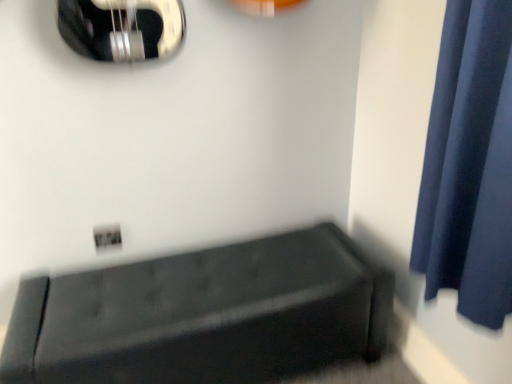
Measure the distance between point (448, 245) and camera.

A distance of 97.10 centimeters exists between point (448, 245) and camera.

Identify the location of dark blue fabric curtain at right. The height and width of the screenshot is (384, 512). (469, 165).

What do you see at coordinates (469, 165) in the screenshot? This screenshot has width=512, height=384. I see `dark blue fabric curtain at right` at bounding box center [469, 165].

Find the location of a particular element. This screenshot has height=384, width=512. velvet black bench at lower right is located at coordinates (205, 316).

This screenshot has width=512, height=384. What do you see at coordinates (205, 316) in the screenshot? I see `velvet black bench at lower right` at bounding box center [205, 316].

At what (x,y) coordinates should I click in order to perform the action: click on dark blue fabric curtain at right. Please return your answer as a coordinate pair (x, y). Looking at the image, I should click on point(469,165).

Which is more to the left, velvet black bench at lower right or dark blue fabric curtain at right?

velvet black bench at lower right.

Does velvet black bench at lower right come behind dark blue fabric curtain at right?

Yes.

Does point (323, 344) lie in front of point (456, 263)?

No, (323, 344) is behind (456, 263).

From the image's perspective, is velvet black bench at lower right on dark blue fabric curtain at right?

No, from the image's perspective, velvet black bench at lower right is not on top of dark blue fabric curtain at right.

From a real-world perspective, is velvet black bench at lower right located beneath dark blue fabric curtain at right?

Yes.

Considering the relative sizes of velvet black bench at lower right and dark blue fabric curtain at right in the image provided, is velvet black bench at lower right thinner than dark blue fabric curtain at right?

In fact, velvet black bench at lower right might be wider than dark blue fabric curtain at right.

Who is shorter, velvet black bench at lower right or dark blue fabric curtain at right?

velvet black bench at lower right is shorter.

Considering the sizes of objects velvet black bench at lower right and dark blue fabric curtain at right in the image provided, who is smaller, velvet black bench at lower right or dark blue fabric curtain at right?

dark blue fabric curtain at right is smaller.

Does velvet black bench at lower right contain dark blue fabric curtain at right?

Definitely not — dark blue fabric curtain at right is not inside velvet black bench at lower right.

Is velvet black bench at lower right directly adjacent to dark blue fabric curtain at right?

There is a gap between velvet black bench at lower right and dark blue fabric curtain at right.

Is velvet black bench at lower right turned away from dark blue fabric curtain at right?

No, dark blue fabric curtain at right is not at the back of velvet black bench at lower right.

The height and width of the screenshot is (384, 512). I want to click on curtain located above the velvet black bench at lower right (from a real-world perspective), so click(469, 165).

Which is more to the left, dark blue fabric curtain at right or velvet black bench at lower right?

velvet black bench at lower right.

Is dark blue fabric curtain at right in front of velvet black bench at lower right?

Yes, it is in front of velvet black bench at lower right.

Considering the points (490, 230) and (380, 313), which point is behind, point (490, 230) or point (380, 313)?

The point (380, 313) is farther.

From the image's perspective, which one is positioned higher, dark blue fabric curtain at right or velvet black bench at lower right?

dark blue fabric curtain at right appears higher in the image.

From a real-world perspective, which is physically above, dark blue fabric curtain at right or velvet black bench at lower right?

From a 3D spatial view, dark blue fabric curtain at right is above.

Is dark blue fabric curtain at right wider than velvet black bench at lower right?

Incorrect, the width of dark blue fabric curtain at right does not surpass that of velvet black bench at lower right.

Considering the sizes of dark blue fabric curtain at right and velvet black bench at lower right in the image, is dark blue fabric curtain at right taller or shorter than velvet black bench at lower right?

Considering their sizes, dark blue fabric curtain at right has more height than velvet black bench at lower right.

Does dark blue fabric curtain at right have a smaller size compared to velvet black bench at lower right?

Indeed, dark blue fabric curtain at right has a smaller size compared to velvet black bench at lower right.

Looking at this image, choose the correct answer: Is dark blue fabric curtain at right inside velvet black bench at lower right or outside it?

dark blue fabric curtain at right lies outside velvet black bench at lower right.

Is dark blue fabric curtain at right far from velvet black bench at lower right?

No.

In the scene shown: Does dark blue fabric curtain at right turn towards velvet black bench at lower right?

No, dark blue fabric curtain at right is not aimed at velvet black bench at lower right.

Where is `furniture to the left of dark blue fabric curtain at right`? The height and width of the screenshot is (384, 512). furniture to the left of dark blue fabric curtain at right is located at coordinates (205, 316).

This screenshot has width=512, height=384. In the image, there is a dark blue fabric curtain at right. Find the location of `furniture below it (from the image's perspective)`. furniture below it (from the image's perspective) is located at coordinates (205, 316).

At what (x,y) coordinates should I click in order to perform the action: click on furniture behind the dark blue fabric curtain at right. Please return your answer as a coordinate pair (x, y). The height and width of the screenshot is (384, 512). Looking at the image, I should click on (205, 316).